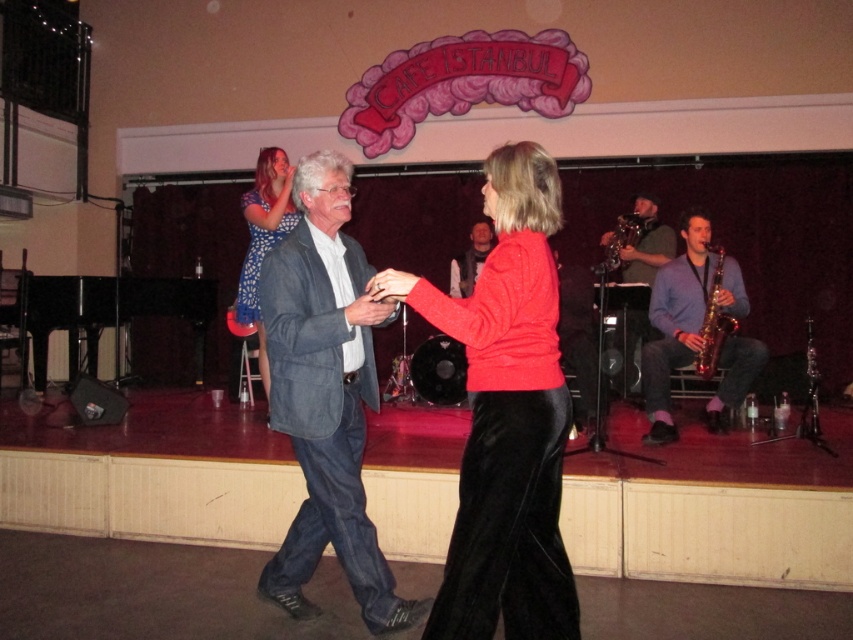
You are a photographer at the event and want to capture a photo that includes both the velvet red sweater at center and the blue dotted dress at upper left. The camera you are using has a maximum focus range of 7 feet. Can you fit both subjects into the frame without moving the camera?

The distance between the velvet red sweater at center and the blue dotted dress at upper left is 7.01 feet, which is slightly beyond the camera maximum focus range of 7 feet. Therefore, you cannot fit both subjects into the frame without moving the camera.

You are a photographer at the event and need to capture a photo of both the velvet red sweater at center and the shiny gold saxophone at right. Can you fit both objects in your camera frame if the maximum width your camera can capture is 1.2 meters?

The velvet red sweater at center might be wider than shiny gold saxophone at right, so it is uncertain if both can fit within the 1.2 meters width. You should check the actual width of the velvet red sweater at center first.